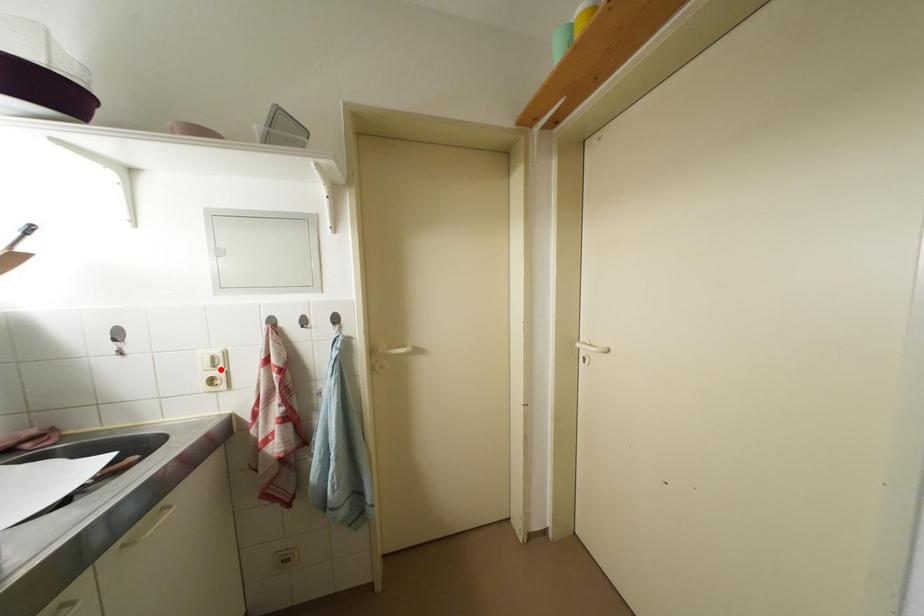
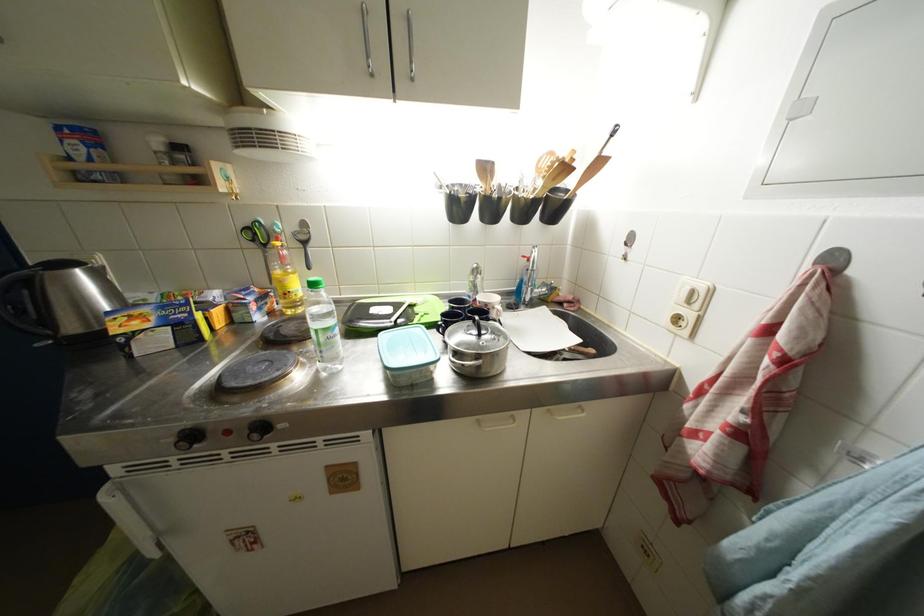
Where in the second image is the point corresponding to the highlighted location from the first image?

(696, 306)